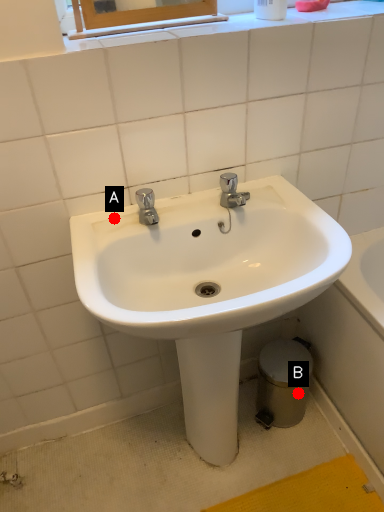
Question: Two points are circled on the image, labeled by A and B beside each circle. Which point is farther to the camera?

Choices:
 (A) A is further
 (B) B is further

Answer: (B)